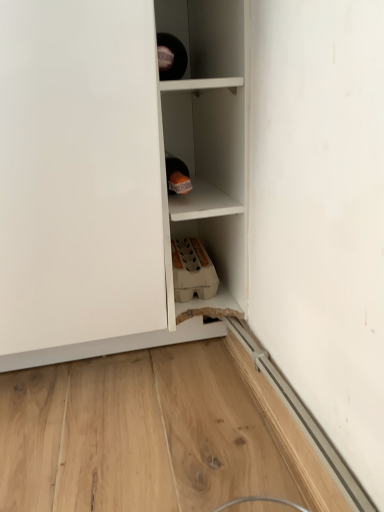
Question: Is white matte cabinet at center to the right of white matte cupboard at center from the viewer's perspective?

Choices:
 (A) yes
 (B) no

Answer: (A)

Question: Is white matte cabinet at center thinner than white matte cupboard at center?

Choices:
 (A) no
 (B) yes

Answer: (B)

Question: From a real-world perspective, is white matte cabinet at center positioned under white matte cupboard at center based on gravity?

Choices:
 (A) no
 (B) yes

Answer: (B)

Question: Is white matte cabinet at center oriented away from white matte cupboard at center?

Choices:
 (A) yes
 (B) no

Answer: (B)

Question: From the image's perspective, is white matte cabinet at center located beneath white matte cupboard at center?

Choices:
 (A) no
 (B) yes

Answer: (A)

Question: Is white matte cabinet at center far from white matte cupboard at center?

Choices:
 (A) no
 (B) yes

Answer: (A)

Question: Is white matte cupboard at center to the left of white matte cabinet at center from the viewer's perspective?

Choices:
 (A) yes
 (B) no

Answer: (A)

Question: Is white matte cupboard at center not inside white matte cabinet at center?

Choices:
 (A) yes
 (B) no

Answer: (A)

Question: Can you confirm if white matte cupboard at center is smaller than white matte cabinet at center?

Choices:
 (A) yes
 (B) no

Answer: (B)

Question: Is white matte cupboard at center touching white matte cabinet at center?

Choices:
 (A) yes
 (B) no

Answer: (A)

Question: Can you confirm if white matte cupboard at center is taller than white matte cabinet at center?

Choices:
 (A) no
 (B) yes

Answer: (A)

Question: Considering the relative sizes of white matte cupboard at center and white matte cabinet at center in the image provided, is white matte cupboard at center wider than white matte cabinet at center?

Choices:
 (A) no
 (B) yes

Answer: (B)

Question: From their relative heights in the image, would you say white matte cupboard at center is taller or shorter than white matte cabinet at center?

Choices:
 (A) short
 (B) tall

Answer: (A)